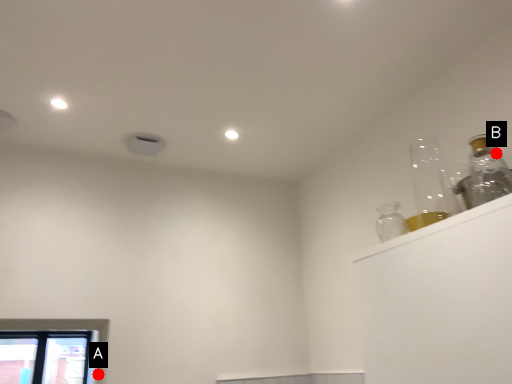
Question: Two points are circled on the image, labeled by A and B beside each circle. Which point is closer to the camera?

Choices:
 (A) A is closer
 (B) B is closer

Answer: (B)